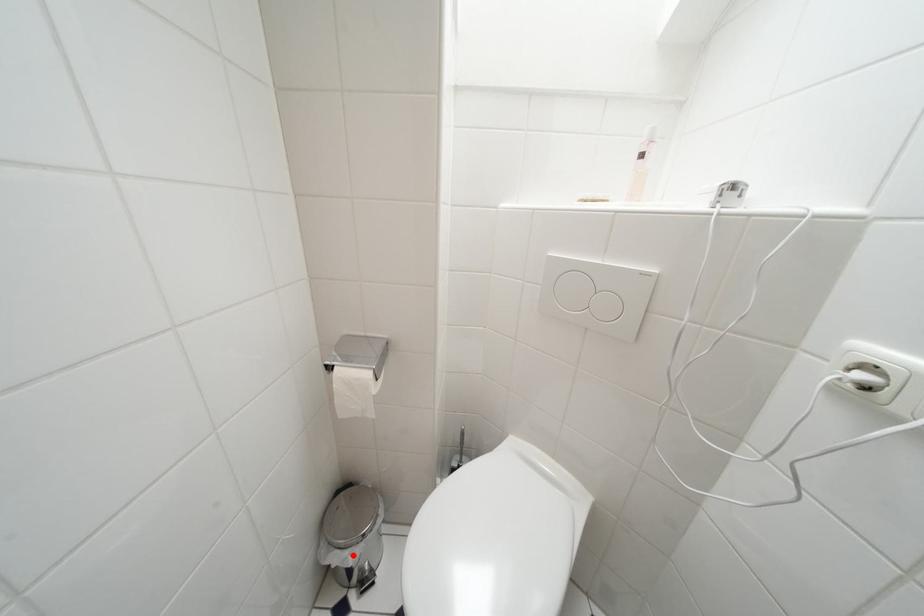
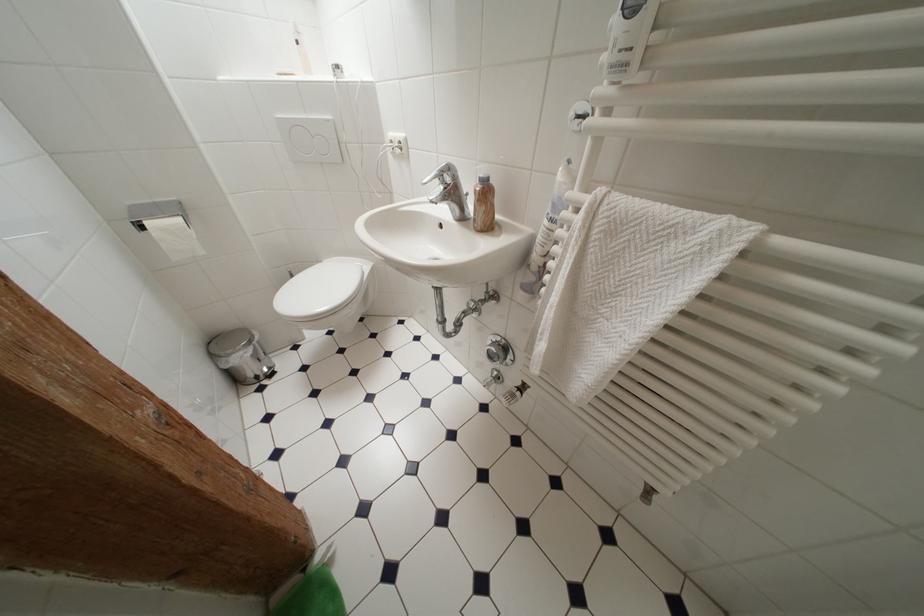
Question: I am providing you with two images of the same scene from different viewpoints. Given a red point in image1, look at the same physical point in image2. Is it:

Choices:
 (A) Closer to the viewpoint
 (B) Farther from the viewpoint

Answer: (A)